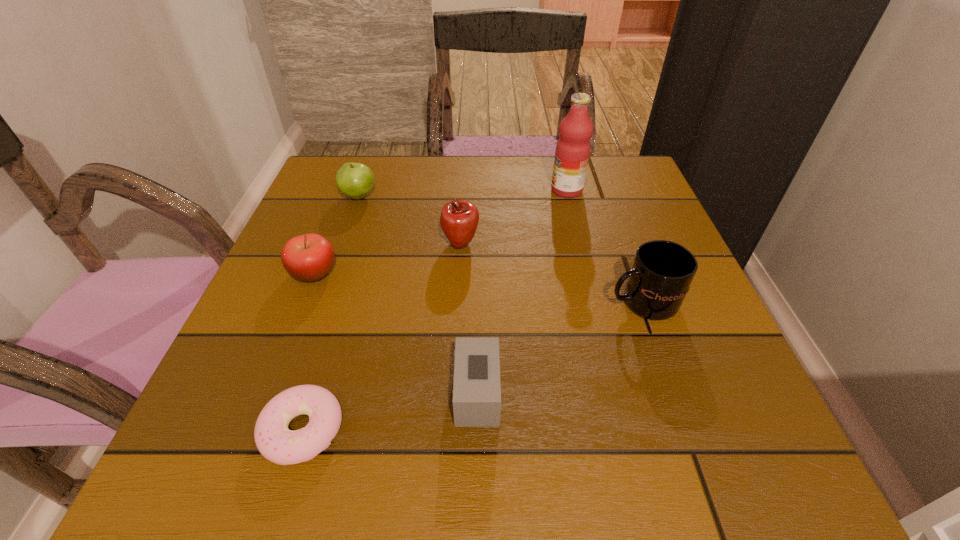
The width and height of the screenshot is (960, 540). Find the location of `free location located 0.290m with the handle on the side of the mug`. free location located 0.290m with the handle on the side of the mug is located at coordinates (449, 302).

Identify the location of vacant space located with the handle on the side of the mug. Image resolution: width=960 pixels, height=540 pixels. (444, 302).

Locate an element on the screen. vacant region located with the handle on the side of the mug is located at coordinates (444, 302).

The image size is (960, 540). What are the coordinates of `free space located on the right of the farthest apple` in the screenshot? It's located at (499, 196).

At what (x,y) coordinates should I click in order to perform the action: click on vacant space located 0.340m on the front-facing side of the alarm clock. Please return your answer as a coordinate pair (x, y). Looking at the image, I should click on (722, 394).

The height and width of the screenshot is (540, 960). In order to click on free space located on the right of the doughnut in this screenshot , I will do `click(511, 430)`.

The height and width of the screenshot is (540, 960). I want to click on fruit juice at the far edge, so click(572, 152).

Identify the location of apple that is at the far edge. This screenshot has width=960, height=540. (355, 180).

The image size is (960, 540). I want to click on alarm clock at the near edge, so click(x=476, y=391).

Identify the location of doughnut that is at the near edge. point(274,440).